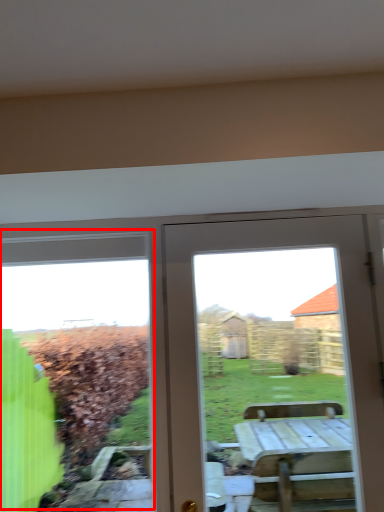
Question: Considering the relative positions of bay window (annotated by the red box) and door in the image provided, where is bay window (annotated by the red box) located with respect to the staircase?

Choices:
 (A) left
 (B) right

Answer: (A)